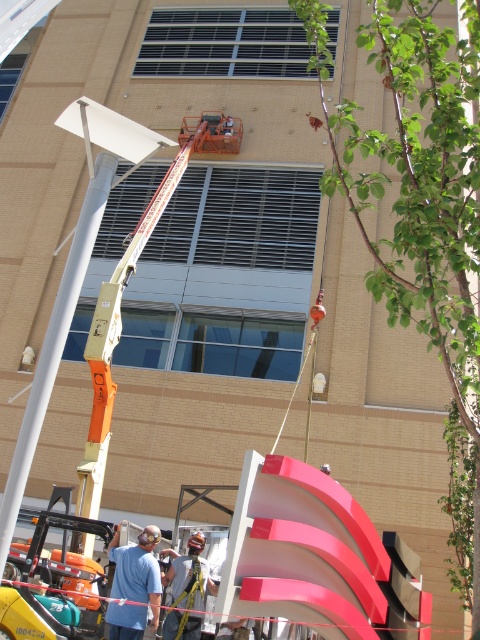
You are a safety inspector standing at the location of the camera. You need to check the distance between yourself and the worker wearing the blue cotton shirt at lower left. According to the scene, is the worker within the 5 meter safety zone required for proper supervision?

The blue cotton shirt at lower left and camera are 7.42 meters apart from each other. Since the required safety zone is 5 meters, the worker is outside the 5 meter safety zone.

Consider the image. You are a construction worker standing at the base of the building and looking up at the two points marked on the crane. Which point, point (117,596) or point (172,579), is closer to you?

Point (117,596) is closer to you because it is in front of point (172,579).

You are a safety inspector observing the construction scene. You notice the blue cotton shirt at lower left and the metallic safety harness at center. According to safety protocols, which object should be visible to ensure proper harness usage? Please answer based on their positions.

The blue cotton shirt at lower left is in front of the metallic safety harness at center, meaning the harness may not be fully visible. For proper safety protocol, the metallic safety harness at center should be clearly visible to ensure it is properly attached and functioning.